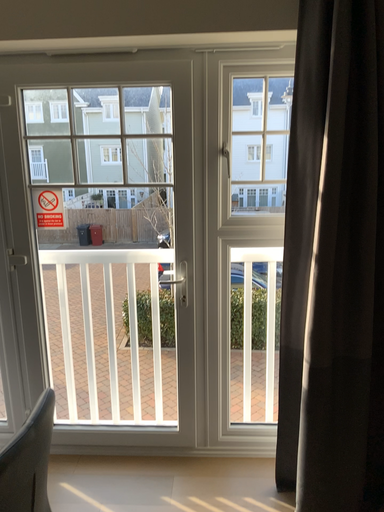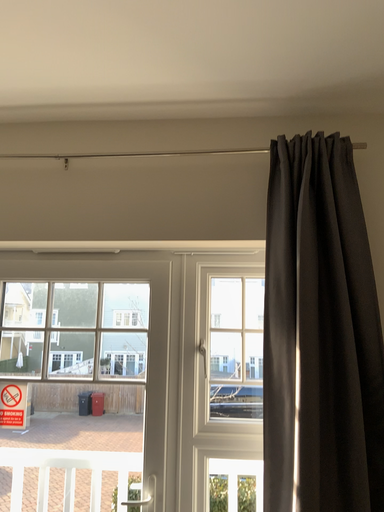
Question: Which way did the camera rotate in the video?

Choices:
 (A) rotated downward
 (B) rotated upward

Answer: (B)